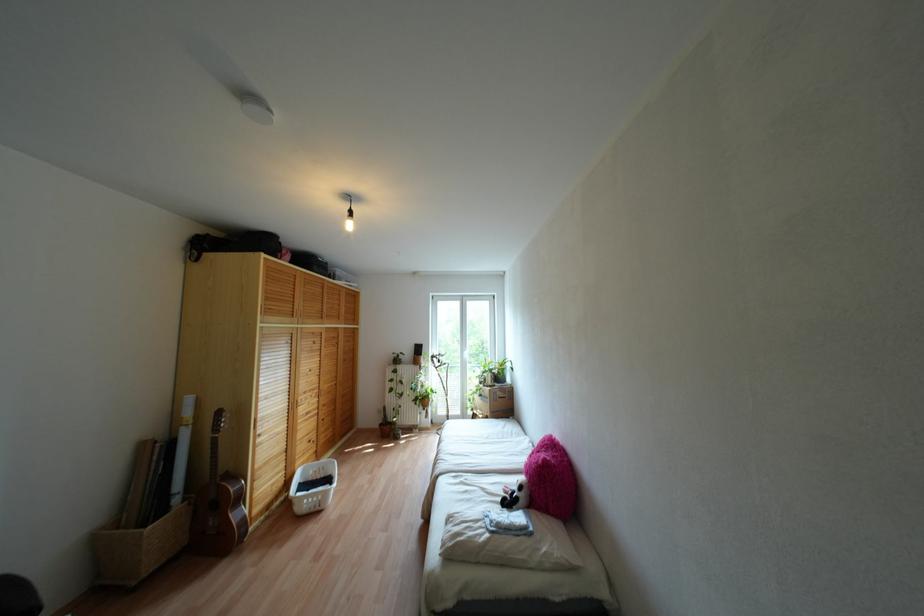
Locate an element on the screen. The image size is (924, 616). white pillow is located at coordinates (504, 533).